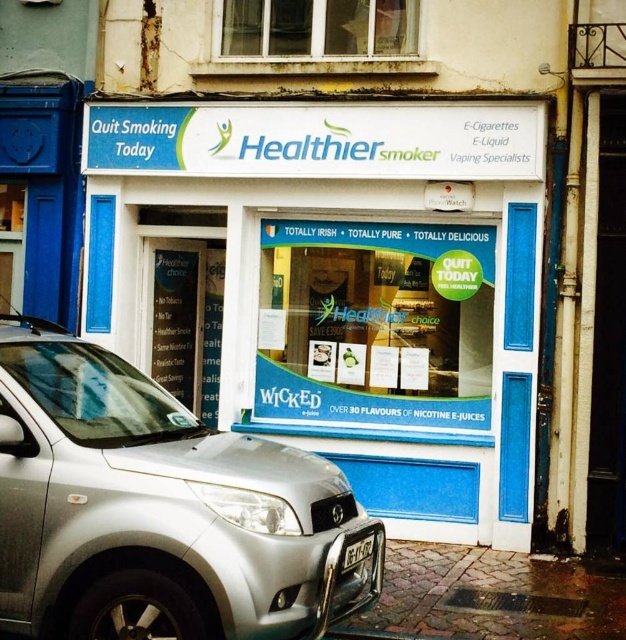
Question: Where is white plastic storefront at center located in relation to silver metallic car at lower left in the image?

Choices:
 (A) below
 (B) above

Answer: (B)

Question: Which point is closer to the camera taking this photo?

Choices:
 (A) (230, 266)
 (B) (115, 461)
 (C) (349, 563)

Answer: (B)

Question: Which of these objects is positioned closest to the white plastic license plate at lower center?

Choices:
 (A) silver metallic car at lower left
 (B) white plastic storefront at center

Answer: (A)

Question: Where is white plastic storefront at center located in relation to silver metallic car at lower left in the image?

Choices:
 (A) right
 (B) left

Answer: (A)

Question: Is white plastic storefront at center smaller than silver metallic car at lower left?

Choices:
 (A) yes
 (B) no

Answer: (B)

Question: Which point is closer to the camera?

Choices:
 (A) silver metallic car at lower left
 (B) white plastic storefront at center
 (C) white plastic license plate at lower center

Answer: (A)